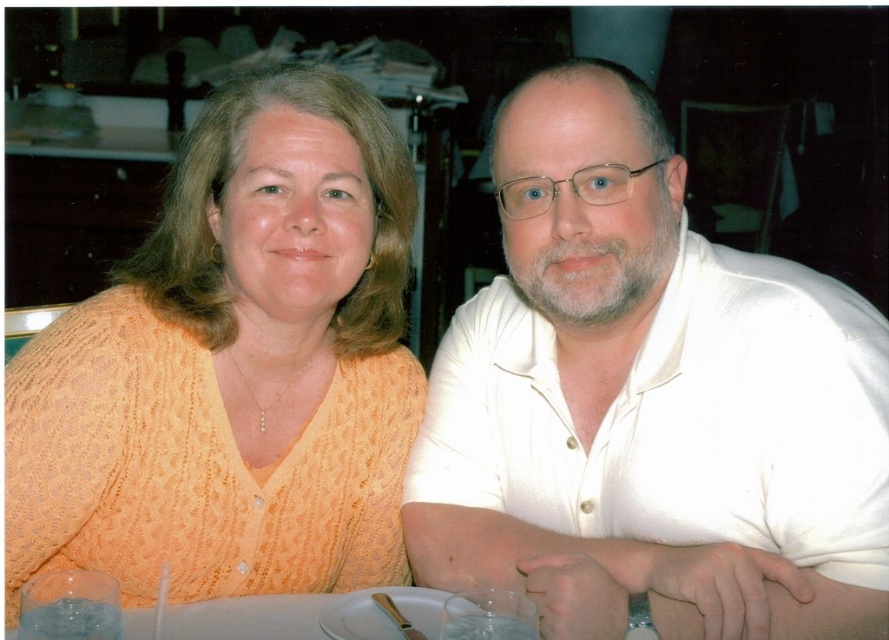
You are a photographer setting up for a group photo. You need to position the white smooth shirt at right and the orange knitted sweater at left so that both are visible in the frame. Based on their current positions, which direction should you adjust the camera to ensure both are fully in the frame?

Since the white smooth shirt at right is to the right of the orange knitted sweater at left, you should position the camera so it faces towards the center between both individuals to ensure both are fully visible in the frame.

You are a photographer setting up a camera at the origin point. The camera can only focus on objects within a 0.5 unit radius. Is the white smooth shirt at right within the focus range?

The white smooth shirt at right is located at point (x=649, y=401). The distance from the origin to this point is sqrt0.627 squared plus 0.731 squared equals approximately sqrt0.393 plus 0.534 equals sqrt0.927 equals approximately 0.963 units. Since 0.963 is greater than 0.5, the shirt is outside the focus range.